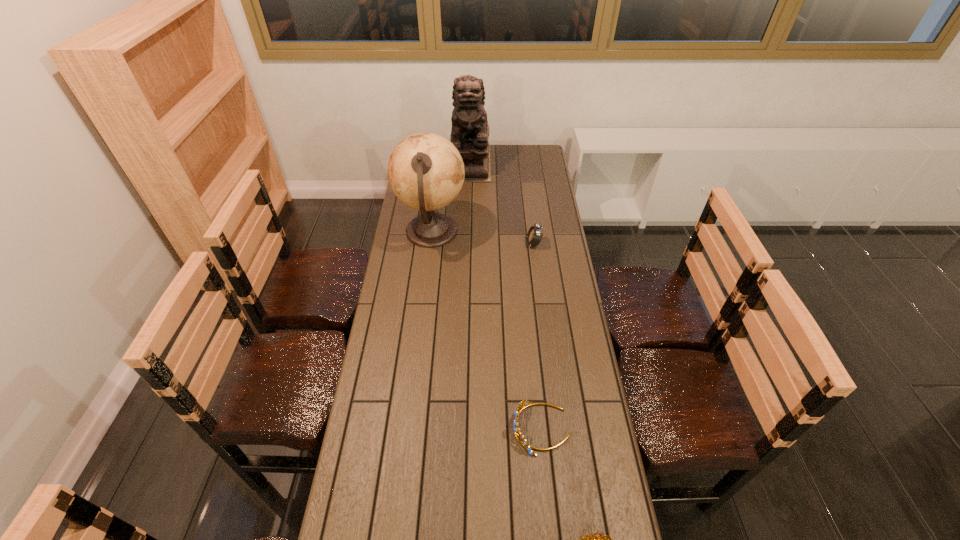
This screenshot has height=540, width=960. Find the location of `free space located 0.360m on the front-facing side of the taller tiara`. free space located 0.360m on the front-facing side of the taller tiara is located at coordinates (394, 428).

Find the location of a particular element. vacant position located on the front-facing side of the taller tiara is located at coordinates (469, 428).

I want to click on free point located 0.180m on the front-facing side of the taller tiara, so coord(453,428).

Identify the location of object situated at the far edge. (470, 131).

Locate an element on the screen. This screenshot has width=960, height=540. object located in the left edge section of the desktop is located at coordinates (426, 172).

Locate an element on the screen. The width and height of the screenshot is (960, 540). alarm clock located in the right edge section of the desktop is located at coordinates (534, 235).

You are a GUI agent. You are given a task and a screenshot of the screen. Output one action in this format:
    pyautogui.click(x=<x>, y=<y>)
    Task: Click on the tiara present at the right edge
    This screenshot has width=960, height=540.
    Given the screenshot: What is the action you would take?
    pyautogui.click(x=524, y=403)

Locate an element on the screen. Image resolution: width=960 pixels, height=540 pixels. vacant space at the right edge is located at coordinates (546, 359).

Locate an element on the screen. free region at the far right corner is located at coordinates (528, 159).

Locate an element on the screen. The image size is (960, 540). vacant area that lies between the globe and the fourth farthest object is located at coordinates (487, 330).